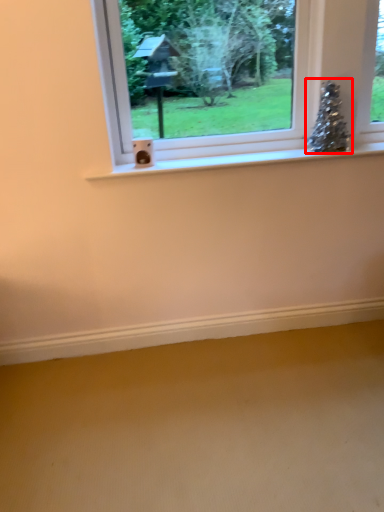
Question: In this image, where is christmas tree (annotated by the red box) located relative to window?

Choices:
 (A) right
 (B) left

Answer: (A)